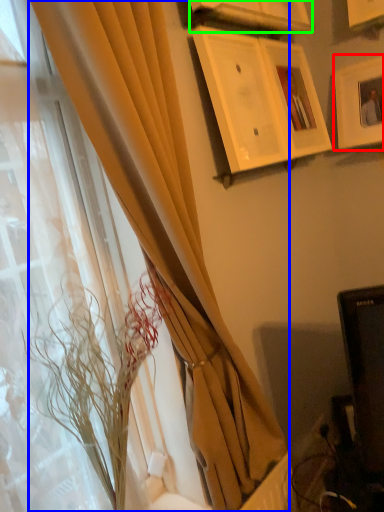
Question: Which is farther away from picture frame (highlighted by a red box)? curtain (highlighted by a blue box) or picture frame (highlighted by a green box)?

Choices:
 (A) curtain
 (B) picture frame

Answer: (A)